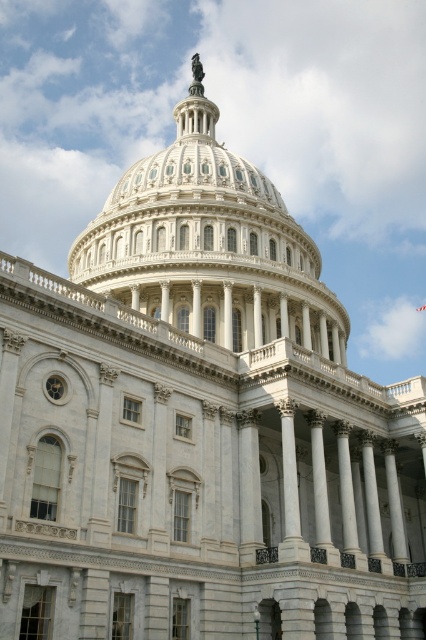
Is white marble column at center wider than white fabric flag at upper center?

In fact, white marble column at center might be narrower than white fabric flag at upper center.

From the picture: Who is lower down, white marble column at center or white fabric flag at upper center?

white marble column at center

The width and height of the screenshot is (426, 640). Describe the element at coordinates (394, 502) in the screenshot. I see `white marble column at center` at that location.

Locate an element on the screen. white marble column at center is located at coordinates coord(394,502).

Between white marble dome at center and white marble column at center, which one has less height?

Standing shorter between the two is white marble column at center.

Between white marble dome at center and white marble column at center, which one appears on the left side from the viewer's perspective?

white marble dome at center

The width and height of the screenshot is (426, 640). In order to click on white marble dome at center in this screenshot , I will do `click(209, 244)`.

In the scene shown: Is white marble dome at center behind white fabric flag at upper center?

No, it is not.

Does white marble dome at center appear under white fabric flag at upper center?

No.

The width and height of the screenshot is (426, 640). What are the coordinates of `white marble dome at center` in the screenshot? It's located at (209, 244).